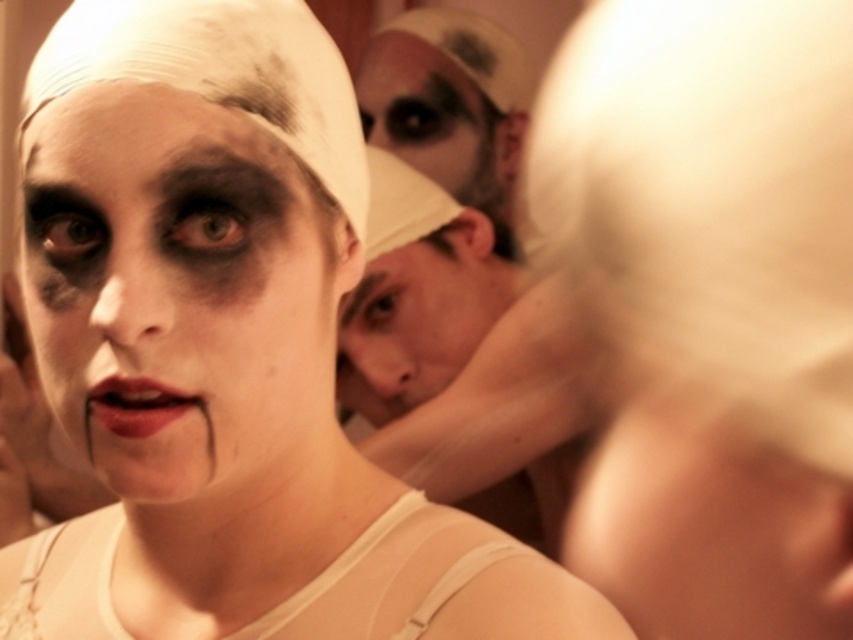
You are a makeup artist preparing to apply the matte red lipstick at center to the smooth skin face at center. Based on the image, can you confirm if the lipstick is directly below the face?

Yes, the smooth skin face at center is positioned over the matte red lipstick at center, so the lipstick is directly below the face.

You are a photographer adjusting your camera settings to focus on two points in the image. The first point is point (387, 292) and the second point is point (148, 419). Which point should you focus on first if you want to capture the closest object to the camera?

Point (387, 292) is closer to the camera than point (148, 419), so you should focus on point (387, 292) first.

From the picture: You are a photographer standing at the center of the scene. You want to take a photo of the smooth beige cap at center and the other person in the background. How far apart are the two subjects?

The smooth beige cap at center and the other person in the background are 34.69 inches apart.